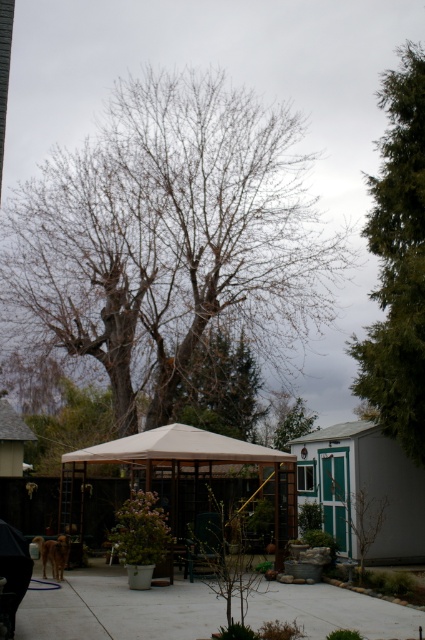
You are planning to place a new bench that is 1.2 meters wide in the backyard. Looking at the image, can you determine if there is enough space on the gray concrete pavement at lower center to accommodate the bench without overlapping the green textured evergreen tree at right?

The green textured evergreen tree at right might be wider than the gray concrete pavement at lower center, so there may not be enough space to place the bench there without overlapping the tree.

You are standing in the backyard and want to place a new bench. The bench requires 1 meter of space in front of it. If you want to place the bench so that it faces the green textured evergreen tree at right, where should you position it to ensure there is enough space?

The green textured evergreen tree at right is located at point [397,262]. To ensure the bench has 1 meter of space in front of it while facing the tree, position the bench so that the distance from its front edge to the tree is at least 1 meter.

You are standing on the gray concrete pavement at lower center and want to walk towards the green textured evergreen tree at right. Which direction should you move?

You should move to the right because the green textured evergreen tree at right is located to the right of the gray concrete pavement at lower center.